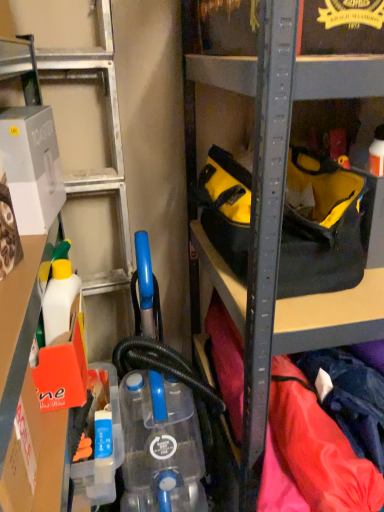
Identify the location of blue translucent bottle at lower center. The image size is (384, 512). (103, 461).

This screenshot has height=512, width=384. Describe the element at coordinates (32, 167) in the screenshot. I see `white cardboard toaster at left` at that location.

Where is `blue translucent bottle at lower center`? The height and width of the screenshot is (512, 384). blue translucent bottle at lower center is located at coordinates (103, 461).

How much distance is there between white cardboard toaster at left and blue translucent bottle at lower center?

white cardboard toaster at left is 21.96 inches from blue translucent bottle at lower center.

Where is `bottle beneath the white cardboard toaster at left (from a real-world perspective)`? bottle beneath the white cardboard toaster at left (from a real-world perspective) is located at coordinates 103,461.

Is white cardboard toaster at left positioned in front of blue translucent bottle at lower center?

Yes.

Consider the image. Based on their sizes in the image, would you say white cardboard toaster at left is bigger or smaller than blue translucent bottle at lower center?

In the image, white cardboard toaster at left appears to be larger than blue translucent bottle at lower center.

Is white plastic container at left aimed at yellow fabric tool bag at center?

Yes, white plastic container at left is aimed at yellow fabric tool bag at center.

Considering the positions of point (119, 164) and point (328, 187), is point (119, 164) closer or farther from the camera than point (328, 187)?

Point (119, 164).

Which object is closer to the camera taking this photo, white plastic container at left or yellow fabric tool bag at center?

Positioned in front is white plastic container at left.

Considering the positions of objects white plastic container at left and blue translucent bottle at lower center in the image provided, who is behind, white plastic container at left or blue translucent bottle at lower center?

blue translucent bottle at lower center is further away from the camera.

From the image's perspective, is white plastic container at left beneath blue translucent bottle at lower center?

Incorrect, from the image's perspective, white plastic container at left is higher than blue translucent bottle at lower center.

Can you confirm if white plastic container at left is thinner than blue translucent bottle at lower center?

Incorrect, the width of white plastic container at left is not less than that of blue translucent bottle at lower center.

Which is behind, point (79, 56) or point (112, 475)?

Point (79, 56)

The height and width of the screenshot is (512, 384). In the image, there is a white cardboard toaster at left. Find the location of `handbag below it (from the image's perspective)`. handbag below it (from the image's perspective) is located at coordinates (321, 230).

Is white cardboard toaster at left to the left of yellow fabric tool bag at center from the viewer's perspective?

Yes.

Is point (18, 132) positioned in front of point (348, 276)?

Yes, it is in front of point (348, 276).

Is white cardboard toaster at left at the left side of white plastic container at left?

No, white cardboard toaster at left is not to the left of white plastic container at left.

Can you confirm if white cardboard toaster at left is shorter than white plastic container at left?

Correct, white cardboard toaster at left is not as tall as white plastic container at left.

Considering the positions of objects white cardboard toaster at left and white plastic container at left in the image provided, who is behind, white cardboard toaster at left or white plastic container at left?

white cardboard toaster at left is more distant.

From the image's perspective, which is above, white cardboard toaster at left or white plastic container at left?

white cardboard toaster at left, from the image's perspective.

Find the location of a particular element. bottle behind the white cardboard toaster at left is located at coordinates (103, 461).

Can you tell me how much blue translucent bottle at lower center and white cardboard toaster at left differ in facing direction?

There is a 4.99-degree angle between the facing directions of blue translucent bottle at lower center and white cardboard toaster at left.

Which is more to the right, blue translucent bottle at lower center or white cardboard toaster at left?

Positioned to the right is blue translucent bottle at lower center.

Can you tell me how much blue translucent bottle at lower center and yellow fabric tool bag at center differ in facing direction?

There is a 84.5-degree angle between the facing directions of blue translucent bottle at lower center and yellow fabric tool bag at center.

Does blue translucent bottle at lower center lie in front of yellow fabric tool bag at center?

No, blue translucent bottle at lower center is behind yellow fabric tool bag at center.

Is blue translucent bottle at lower center not near yellow fabric tool bag at center?

No, blue translucent bottle at lower center is in close proximity to yellow fabric tool bag at center.

Considering the positions of objects blue translucent bottle at lower center and yellow fabric tool bag at center in the image provided, who is more to the right, blue translucent bottle at lower center or yellow fabric tool bag at center?

yellow fabric tool bag at center.

This screenshot has width=384, height=512. Find the location of `bottle below the white cardboard toaster at left (from the image's perspective)`. bottle below the white cardboard toaster at left (from the image's perspective) is located at coordinates (103, 461).

Find the location of a particular element. handbag above the white plastic container at left (from a real-world perspective) is located at coordinates pos(321,230).

Estimate the real-world distances between objects in this image. Which object is further from blue translucent bottle at lower center, white cardboard toaster at left or white plastic container at left?

Based on the image, white plastic container at left appears to be further to blue translucent bottle at lower center.

When comparing their distances from white cardboard toaster at left, does blue translucent bottle at lower center or white plastic container at left seem further?

The object further to white cardboard toaster at left is blue translucent bottle at lower center.

Looking at this image, which object lies nearer to the anchor point white cardboard toaster at left, yellow fabric tool bag at center or blue translucent bottle at lower center?

yellow fabric tool bag at center.

Which object lies nearer to the anchor point blue translucent bottle at lower center, white plastic container at left or yellow fabric tool bag at center?

The object closer to blue translucent bottle at lower center is yellow fabric tool bag at center.

Considering their positions, is blue translucent bottle at lower center positioned closer to yellow fabric tool bag at center than white cardboard toaster at left?

Among the two, white cardboard toaster at left is located nearer to yellow fabric tool bag at center.

Estimate the real-world distances between objects in this image. Which object is closer to white plastic container at left, blue translucent bottle at lower center or white cardboard toaster at left?

white cardboard toaster at left lies closer to white plastic container at left than the other object.

When comparing their distances from white plastic container at left, does white cardboard toaster at left or yellow fabric tool bag at center seem closer?

Among the two, white cardboard toaster at left is located nearer to white plastic container at left.

Considering their positions, is white plastic container at left positioned closer to white cardboard toaster at left than blue translucent bottle at lower center?

Among the two, white plastic container at left is located nearer to white cardboard toaster at left.

Identify the location of handbag located between white plastic container at left and blue translucent bottle at lower center in the depth direction. (321, 230).

Locate an element on the screen. This screenshot has width=384, height=512. handbag between white cardboard toaster at left and blue translucent bottle at lower center vertically is located at coordinates (321, 230).

The width and height of the screenshot is (384, 512). What are the coordinates of `box positioned between white plastic container at left and blue translucent bottle at lower center from near to far` in the screenshot? It's located at (32, 167).

Locate an element on the screen. box located between white plastic container at left and yellow fabric tool bag at center in the left-right direction is located at coordinates (32, 167).